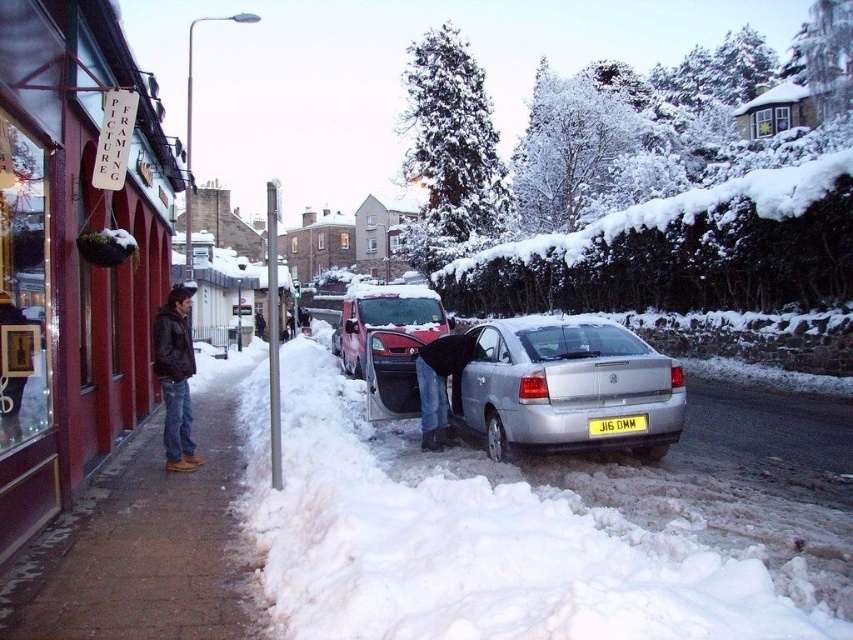
Question: From the image, what is the correct spatial relationship of brown brick pavement at lower left in relation to jeans at center?

Choices:
 (A) left
 (B) right

Answer: (A)

Question: Does brown brick pavement at lower left have a lesser width compared to yellow matte license plate at center?

Choices:
 (A) no
 (B) yes

Answer: (A)

Question: Which object is positioned farthest from the white fluffy snow at lower center?

Choices:
 (A) metallic red van at center
 (B) silver metallic sedan at center
 (C) dark brown leather jacket at left

Answer: (A)

Question: Which object is the closest to the metallic red van at center?

Choices:
 (A) white fluffy snow at lower center
 (B) matte black sign at center

Answer: (A)

Question: Does dark brown leather jacket at left have a larger size compared to yellow matte license plate at center?

Choices:
 (A) no
 (B) yes

Answer: (B)

Question: Which of these objects is positioned farthest from the jeans at center?

Choices:
 (A) dark brown leather jacket at left
 (B) white fluffy snow at lower center

Answer: (A)